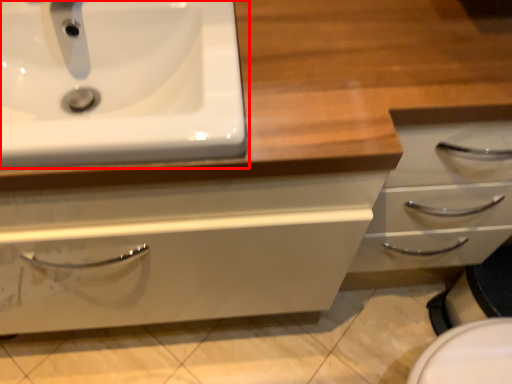
Question: From the image's perspective, considering the relative positions of sink (annotated by the red box) and plumbing fixture in the image provided, where is sink (annotated by the red box) located with respect to the staircase?

Choices:
 (A) above
 (B) below

Answer: (B)